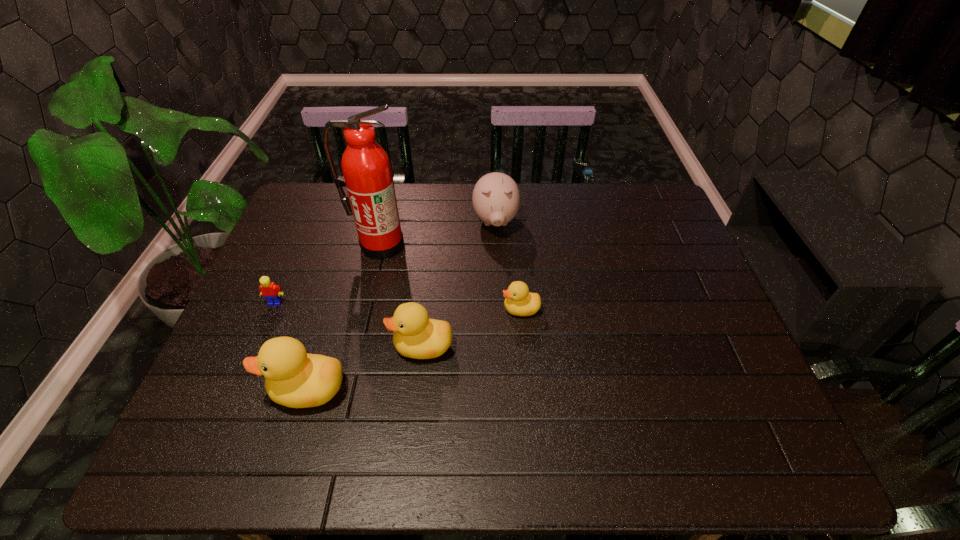
Identify the location of vacant point at the far right corner. (614, 197).

Identify the location of blank area at the near right corner. This screenshot has height=540, width=960. (741, 388).

Find the location of `free spot between the piggy bank and the tallest object`. free spot between the piggy bank and the tallest object is located at coordinates (438, 233).

At what (x,y) coordinates should I click in order to perform the action: click on free spot between the Lego and the second duckling from left to right. Please return your answer as a coordinate pair (x, y). The width and height of the screenshot is (960, 540). Looking at the image, I should click on (348, 325).

Find the location of `blank region between the farthest duckling and the leftmost object`. blank region between the farthest duckling and the leftmost object is located at coordinates (398, 306).

Where is `free space between the second duckling from right to left and the fire extinguisher`? free space between the second duckling from right to left and the fire extinguisher is located at coordinates (401, 295).

The height and width of the screenshot is (540, 960). Find the location of `free space between the piggy bank and the Lego`. free space between the piggy bank and the Lego is located at coordinates (386, 262).

Where is `free space that is in between the nearest duckling and the tallest object`? Image resolution: width=960 pixels, height=540 pixels. free space that is in between the nearest duckling and the tallest object is located at coordinates (344, 317).

At what (x,y) coordinates should I click in order to perform the action: click on blank region between the piggy bank and the leftmost object. Please return your answer as a coordinate pair (x, y). This screenshot has height=540, width=960. Looking at the image, I should click on (386, 262).

Where is `empty space that is in between the Lego and the rightmost duckling`? This screenshot has height=540, width=960. empty space that is in between the Lego and the rightmost duckling is located at coordinates (398, 306).